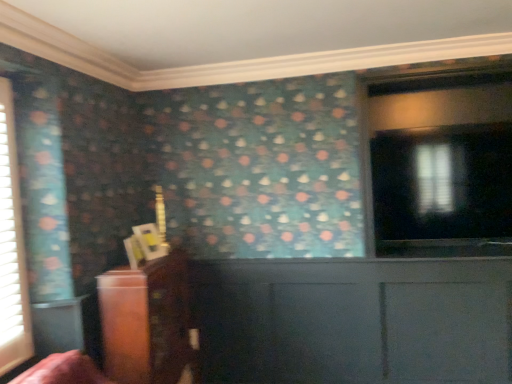
Question: Can you confirm if white textured blinds at left is positioned to the left of transparent glass window at upper right?

Choices:
 (A) no
 (B) yes

Answer: (B)

Question: Is white textured blinds at left turned away from transparent glass window at upper right?

Choices:
 (A) yes
 (B) no

Answer: (B)

Question: From the image's perspective, does white textured blinds at left appear lower than transparent glass window at upper right?

Choices:
 (A) no
 (B) yes

Answer: (B)

Question: Is white textured blinds at left closer to the viewer compared to transparent glass window at upper right?

Choices:
 (A) yes
 (B) no

Answer: (A)

Question: Is white textured blinds at left directly adjacent to transparent glass window at upper right?

Choices:
 (A) yes
 (B) no

Answer: (B)

Question: From a real-world perspective, is white textured blinds at left under transparent glass window at upper right?

Choices:
 (A) yes
 (B) no

Answer: (A)

Question: Does transparent glass window at upper right have a lesser width compared to white textured blinds at left?

Choices:
 (A) no
 (B) yes

Answer: (A)

Question: Is transparent glass window at upper right next to white textured blinds at left and touching it?

Choices:
 (A) no
 (B) yes

Answer: (A)

Question: Can you confirm if transparent glass window at upper right is shorter than white textured blinds at left?

Choices:
 (A) no
 (B) yes

Answer: (B)

Question: From a real-world perspective, is transparent glass window at upper right positioned under white textured blinds at left based on gravity?

Choices:
 (A) yes
 (B) no

Answer: (B)

Question: From the image's perspective, is transparent glass window at upper right beneath white textured blinds at left?

Choices:
 (A) no
 (B) yes

Answer: (A)

Question: Is transparent glass window at upper right bigger than white textured blinds at left?

Choices:
 (A) yes
 (B) no

Answer: (A)

Question: Does wooden cabinet at left have a greater height compared to white textured blinds at left?

Choices:
 (A) no
 (B) yes

Answer: (A)